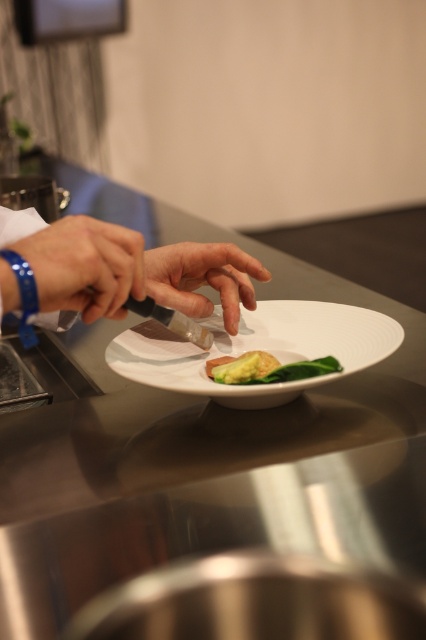
Question: Does white glossy plate at center come in front of green matte avocado at center?

Choices:
 (A) no
 (B) yes

Answer: (B)

Question: Is the position of blue rubber band at center more distant than that of matte white hand at center?

Choices:
 (A) no
 (B) yes

Answer: (A)

Question: Based on their relative distances, which object is nearer to the matte white hand at center?

Choices:
 (A) white glossy plate at center
 (B) green matte avocado at center

Answer: (A)

Question: Which is nearer to the matte white hand at center?

Choices:
 (A) blue rubber band at center
 (B) green matte avocado at center

Answer: (B)

Question: Which is farther from the white glossy plate at center?

Choices:
 (A) blue rubber band at center
 (B) matte white hand at center
 (C) green matte avocado at center

Answer: (A)

Question: Can you confirm if blue rubber band at center is positioned to the right of matte white hand at center?

Choices:
 (A) yes
 (B) no

Answer: (B)